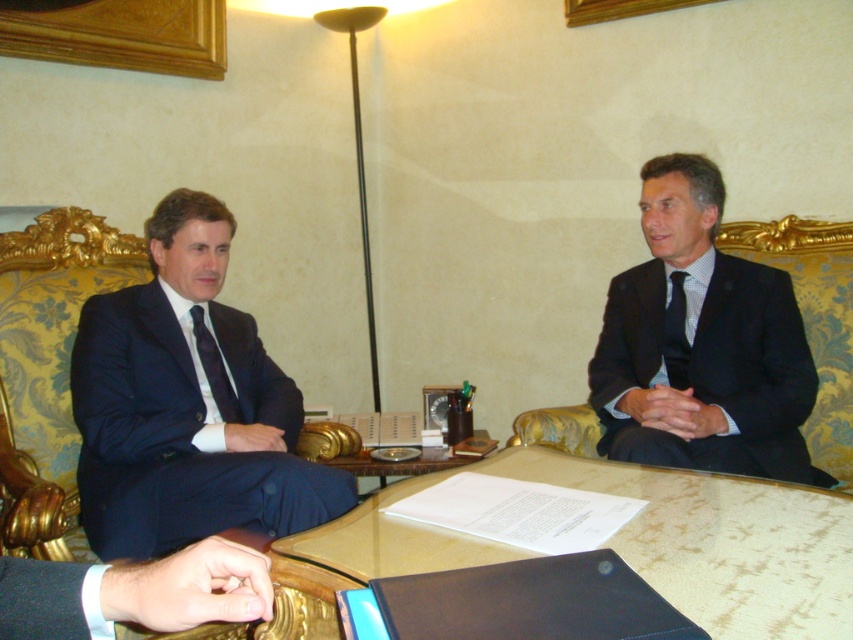
Is point (119, 497) positioned behind point (728, 333)?

No, it is not.

Is navy blue suit at left positioned at the back of matte black suit at right?

No, navy blue suit at left is closer to the viewer.

Where is `navy blue suit at left`? The image size is (853, 640). navy blue suit at left is located at coordinates (187, 404).

Image resolution: width=853 pixels, height=640 pixels. What do you see at coordinates (187, 404) in the screenshot? I see `navy blue suit at left` at bounding box center [187, 404].

Does point (161, 529) come farther from viewer compared to point (200, 353)?

No, it is not.

The image size is (853, 640). What are the coordinates of `navy blue suit at left` in the screenshot? It's located at (187, 404).

Can you confirm if matte black suit at right is positioned to the left of matte black tie at left?

In fact, matte black suit at right is to the right of matte black tie at left.

Between point (798, 438) and point (202, 368), which one is positioned behind?

Point (202, 368)

I want to click on matte black suit at right, so (x=701, y=344).